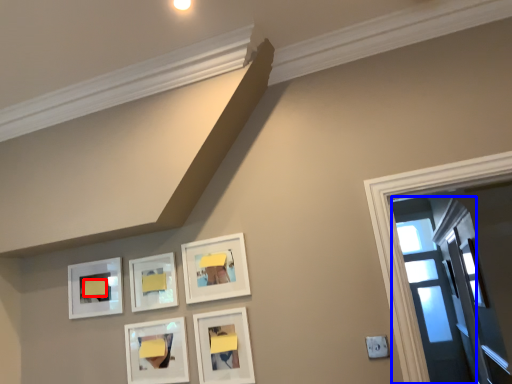
Question: Which object is further to the camera taking this photo, furniture (highlighted by a red box) or glass door (highlighted by a blue box)?

Choices:
 (A) furniture
 (B) glass door

Answer: (B)